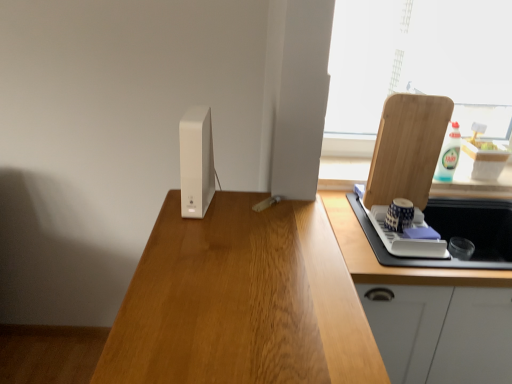
Where is `free space in front of blue and white ceramic cup at right, acting as the second appliance starting from the left`? free space in front of blue and white ceramic cup at right, acting as the second appliance starting from the left is located at coordinates (410, 258).